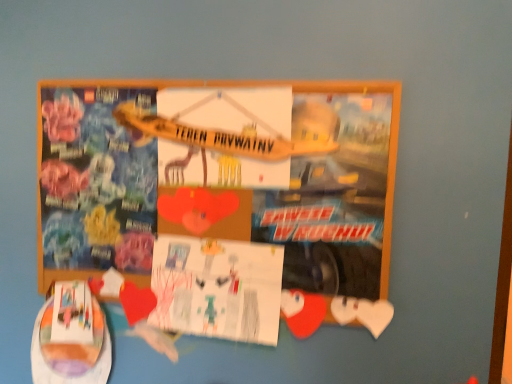
Question: Can you confirm if white paper at center is taller than matte cardboard poster at center?

Choices:
 (A) no
 (B) yes

Answer: (A)

Question: Would you say white paper at center is outside matte cardboard poster at center?

Choices:
 (A) yes
 (B) no

Answer: (B)

Question: Can you confirm if white paper at center is wider than matte cardboard poster at center?

Choices:
 (A) no
 (B) yes

Answer: (A)

Question: Can you confirm if white paper at center is thinner than matte cardboard poster at center?

Choices:
 (A) yes
 (B) no

Answer: (A)

Question: Is white paper at center bigger than matte cardboard poster at center?

Choices:
 (A) no
 (B) yes

Answer: (A)

Question: Does white paper at center have a lesser height compared to matte cardboard poster at center?

Choices:
 (A) yes
 (B) no

Answer: (A)

Question: Can you confirm if matte cardboard poster at center is smaller than white paper at center?

Choices:
 (A) no
 (B) yes

Answer: (A)

Question: Considering the relative sizes of matte cardboard poster at center and white paper at center in the image provided, is matte cardboard poster at center wider than white paper at center?

Choices:
 (A) no
 (B) yes

Answer: (B)

Question: Considering the relative sizes of matte cardboard poster at center and white paper at center in the image provided, is matte cardboard poster at center taller than white paper at center?

Choices:
 (A) no
 (B) yes

Answer: (B)

Question: Is white paper at center completely or partially inside matte cardboard poster at center?

Choices:
 (A) no
 (B) yes

Answer: (B)

Question: Would you say matte cardboard poster at center is a long distance from white paper at center?

Choices:
 (A) no
 (B) yes

Answer: (A)

Question: Is matte cardboard poster at center located outside white paper at center?

Choices:
 (A) yes
 (B) no

Answer: (A)

Question: Is white paper at center situated inside matte cardboard poster at center or outside?

Choices:
 (A) outside
 (B) inside

Answer: (B)